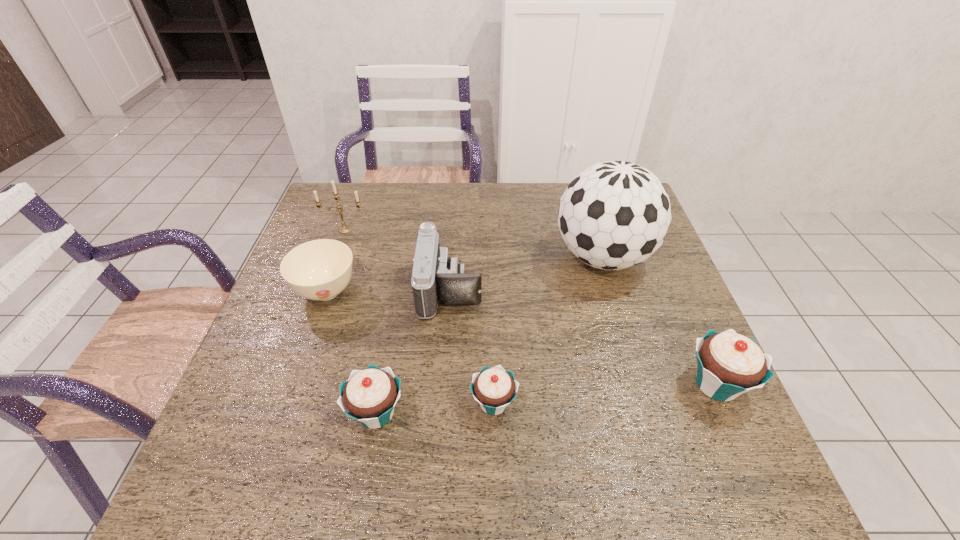
Identify the location of the leftmost cupcake. The width and height of the screenshot is (960, 540). point(369,396).

The width and height of the screenshot is (960, 540). Identify the location of the shortest cupcake. (494, 388).

Where is `the tallest cupcake`? Image resolution: width=960 pixels, height=540 pixels. the tallest cupcake is located at coordinates (728, 364).

Find the location of a particular element. The width and height of the screenshot is (960, 540). candle is located at coordinates (343, 229).

The image size is (960, 540). What are the coordinates of `camera` in the screenshot? It's located at (436, 277).

Find the location of `soccer ball`. soccer ball is located at coordinates [615, 214].

At what (x,y) coordinates should I click in order to perform the action: click on sugar bowl. Please return your answer as a coordinate pair (x, y). The width and height of the screenshot is (960, 540). Looking at the image, I should click on (319, 270).

Where is `vacant space located 0.190m on the back of the second tallest cupcake`? The width and height of the screenshot is (960, 540). vacant space located 0.190m on the back of the second tallest cupcake is located at coordinates pos(394,319).

Locate an element on the screen. This screenshot has width=960, height=540. vacant space situated 0.290m on the back of the second cupcake from right to left is located at coordinates (491, 287).

Identify the location of blank space located 0.350m on the back of the rightmost cupcake. (660, 255).